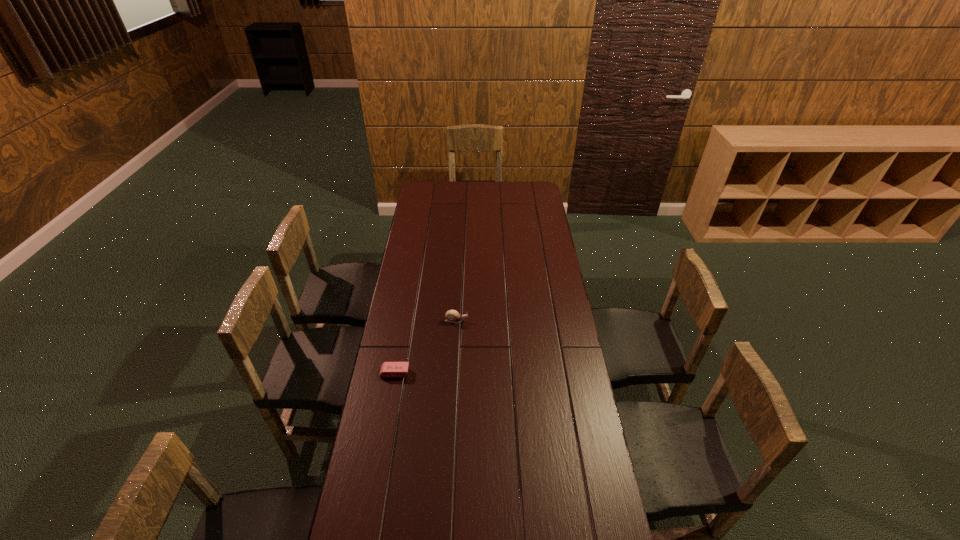
This screenshot has height=540, width=960. I want to click on the right object, so click(x=453, y=316).

The height and width of the screenshot is (540, 960). Find the location of `the taller object`. the taller object is located at coordinates click(x=453, y=316).

Find the location of a particular element. The image size is (960, 540). the nearer object is located at coordinates (388, 369).

Where is `the left object`? the left object is located at coordinates (388, 369).

Find the location of a particular element. This screenshot has width=960, height=540. free space located on the front-facing side of the farther object is located at coordinates (492, 321).

This screenshot has height=540, width=960. Identify the location of vacant space positioned on the right of the nearer object. (474, 373).

The width and height of the screenshot is (960, 540). I want to click on object situated at the left edge, so click(x=388, y=369).

Where is `free location at the far edge`? Image resolution: width=960 pixels, height=540 pixels. free location at the far edge is located at coordinates (486, 199).

The width and height of the screenshot is (960, 540). What are the coordinates of `vacant space at the left edge of the desktop` in the screenshot? It's located at (419, 377).

Find the location of a particular element. Image resolution: width=960 pixels, height=540 pixels. vacant space at the right edge is located at coordinates (540, 242).